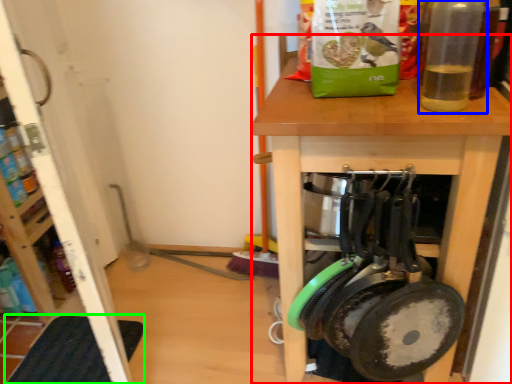
Question: Based on their relative distances, which object is farther from desk (highlighted by a red box)? Choose from bottle (highlighted by a blue box) and mat (highlighted by a green box).

Choices:
 (A) bottle
 (B) mat

Answer: (B)